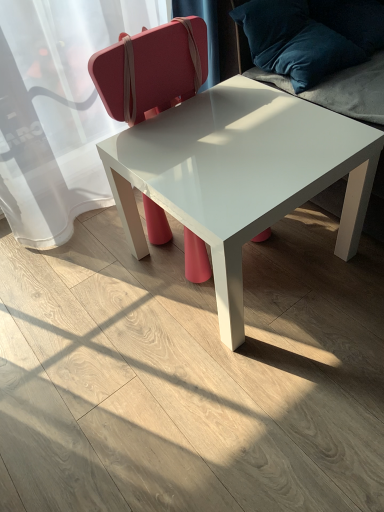
Identify the location of vacant region above white glossy table at center (from a real-world perspective). The height and width of the screenshot is (512, 384). (237, 140).